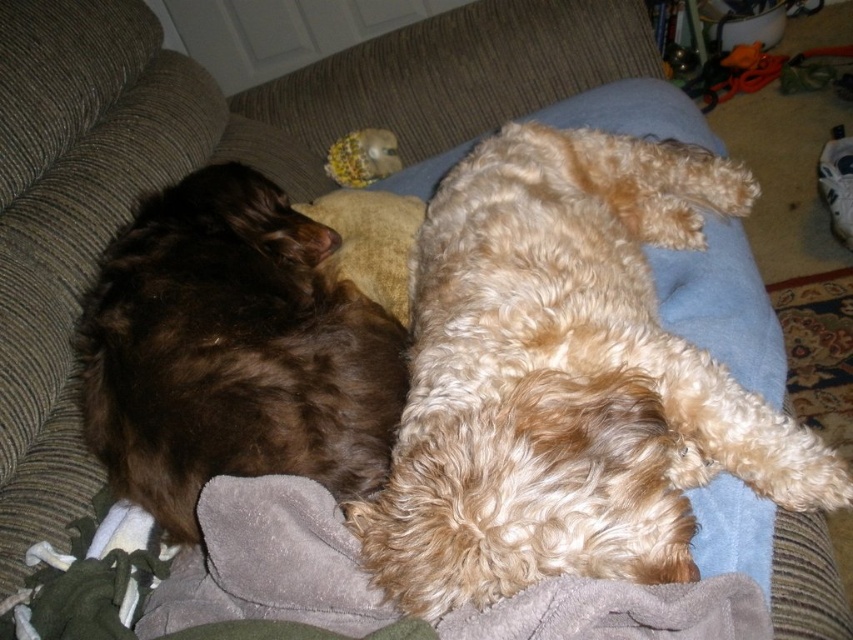
Is point (555, 250) behind point (198, 538)?

Yes.

Can you confirm if curly golden fur dog at center is bigger than brown fluffy dog at left?

Yes.

Locate an element on the screen. curly golden fur dog at center is located at coordinates (566, 380).

Find the location of a particular element. The height and width of the screenshot is (640, 853). curly golden fur dog at center is located at coordinates (566, 380).